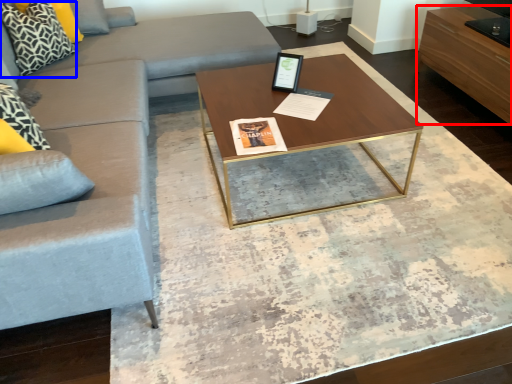
Question: Which object is further to the camera taking this photo, drawer (highlighted by a red box) or pillow (highlighted by a blue box)?

Choices:
 (A) drawer
 (B) pillow

Answer: (B)